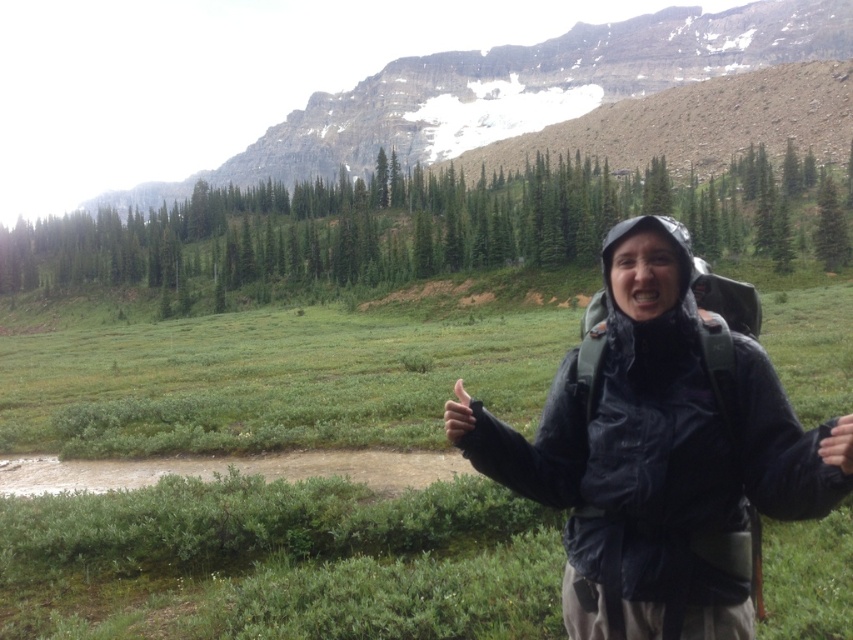
Looking at this image, who is more distant from viewer, (692, 356) or (619, 38)?

The point (619, 38) is behind.

Between matte black jacket at center and green grassy mountain at upper center, which one appears on the left side from the viewer's perspective?

green grassy mountain at upper center is more to the left.

You are a GUI agent. You are given a task and a screenshot of the screen. Output one action in this format:
    pyautogui.click(x=<x>, y=<y>)
    Task: Click on the matte black jacket at center
    This screenshot has height=640, width=853.
    Given the screenshot: What is the action you would take?
    pyautogui.click(x=659, y=456)